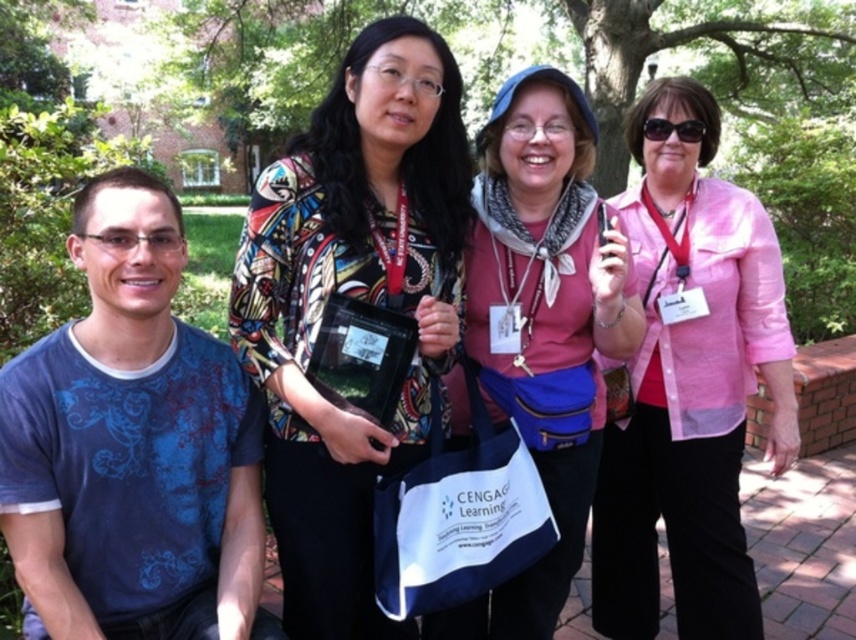
Question: Estimate the real-world distances between objects in this image. Which object is farther from the printed fabric blouse at center?

Choices:
 (A) blue printed t-shirt at left
 (B) pink sheer blouse at center
 (C) black plastic sunglasses at upper center
 (D) black plastic bag at center

Answer: (C)

Question: Is blue printed t-shirt at left to the right of pink sheer blouse at center from the viewer's perspective?

Choices:
 (A) no
 (B) yes

Answer: (A)

Question: Which object appears closest to the camera in this image?

Choices:
 (A) blue printed t-shirt at left
 (B) black plastic bag at center
 (C) black plastic sunglasses at upper center
 (D) pink sheer blouse at center

Answer: (A)

Question: Which point appears farthest from the camera in this image?

Choices:
 (A) (331, 339)
 (B) (622, 236)
 (C) (761, 221)

Answer: (C)

Question: Is pink sheer blouse at center further to camera compared to black plastic sunglasses at upper center?

Choices:
 (A) yes
 (B) no

Answer: (B)

Question: Is blue printed t-shirt at left below black plastic bag at center?

Choices:
 (A) no
 (B) yes

Answer: (B)